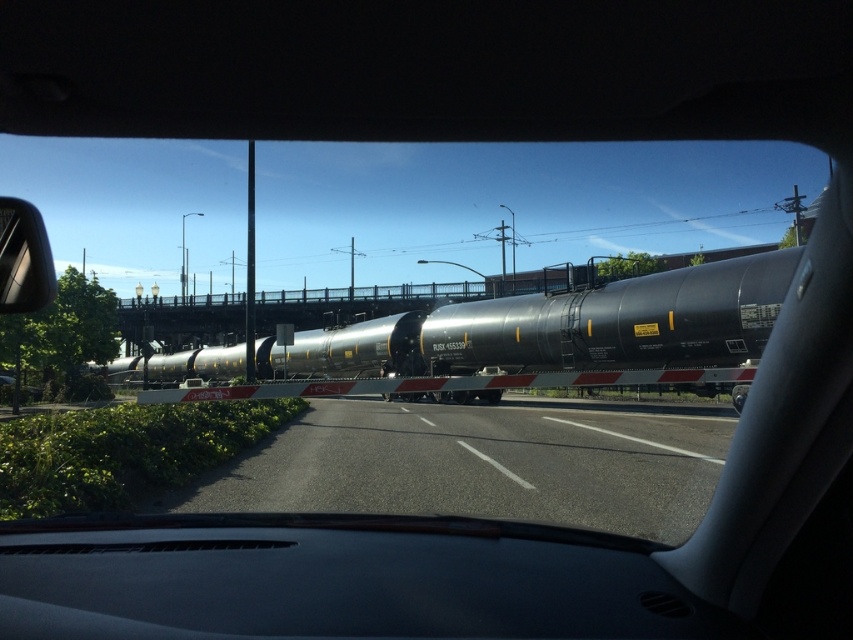
You are driving and see the matte black tank car at center through the windshield. Based on its position, can you estimate whether it is closer to the front or the back of the vehicle?

The matte black tank car at center is located at point coordinates that are closer to the front of the vehicle since the coordinates are in the lower part of the image, indicating proximity to the windshield.

You are driving a car and notice the black asphalt highway at center and the silver metallic side mirror at left in your view. Which object appears larger in your field of vision?

The black asphalt highway at center appears larger because it is taller than the silver metallic side mirror at left.